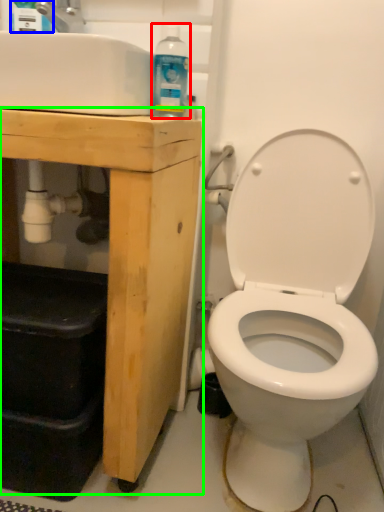
Question: Which object is positioned farthest from cleaning product (highlighted by a red box)? Select from cleaning product (highlighted by a blue box) and porcelain (highlighted by a green box).

Choices:
 (A) cleaning product
 (B) porcelain

Answer: (A)